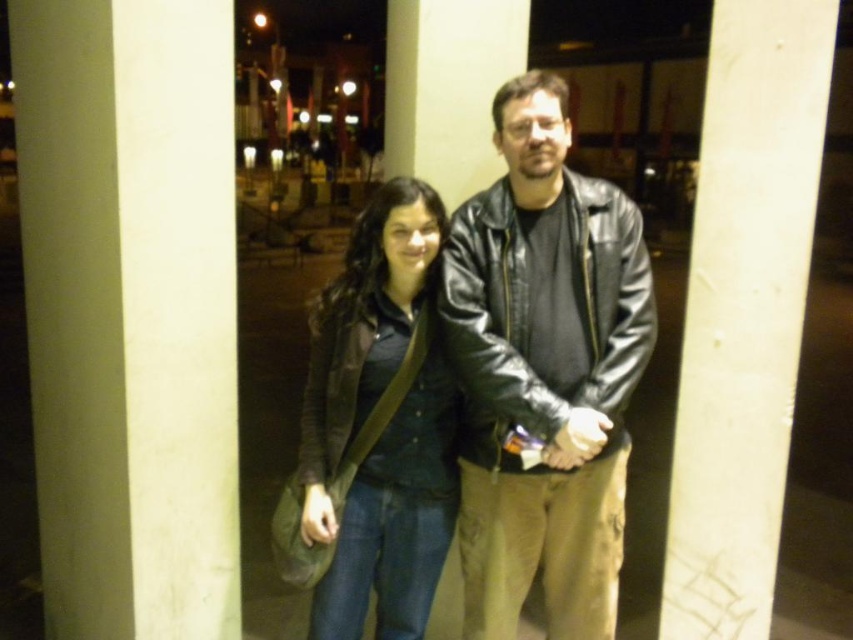
You are a photographer setting up a shot. You have two objects in your frame, the white smooth pillar at left and the black leather jacket at center. You need to know which one is wider so you can adjust your focus. Which object is wider?

The white smooth pillar at left is wider than the black leather jacket at center according to the description.

You are a photographer trying to capture a photo of the black leather jacket at center and the white smooth pillar at center. If you want to ensure both are fully visible in the frame, which object should you adjust your camera focus to prioritize based on their sizes?

The black leather jacket at center is wider than the white smooth pillar at center, so you should prioritize focusing on the black leather jacket at center to ensure it fits within the frame.